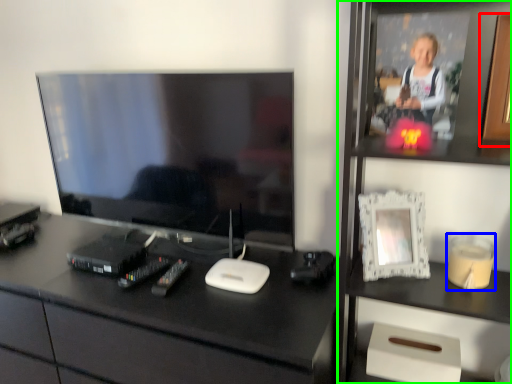
Question: Which object is the farthest from picture frame (highlighted by a red box)? Choose among these: candle holder (highlighted by a blue box) or bookshelf (highlighted by a green box).

Choices:
 (A) candle holder
 (B) bookshelf

Answer: (A)